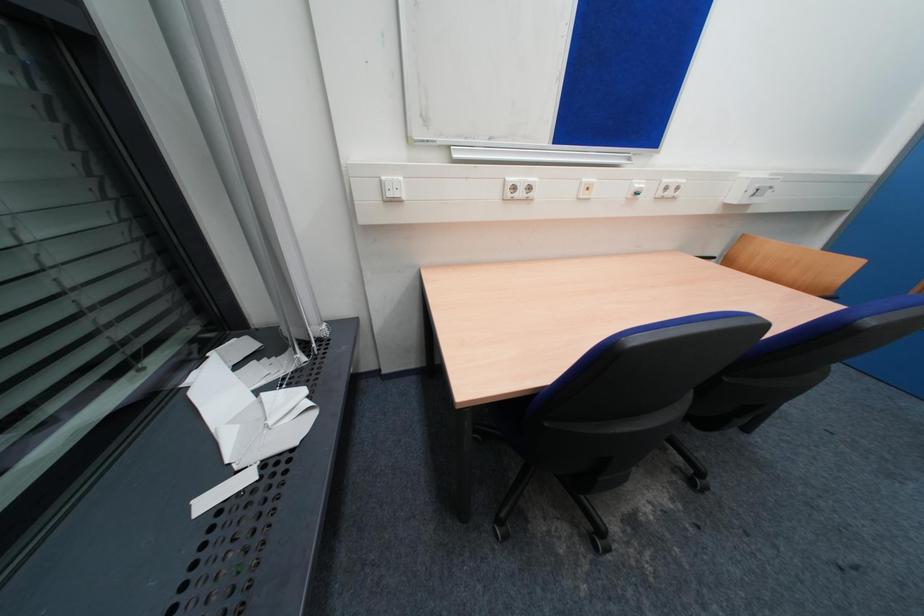
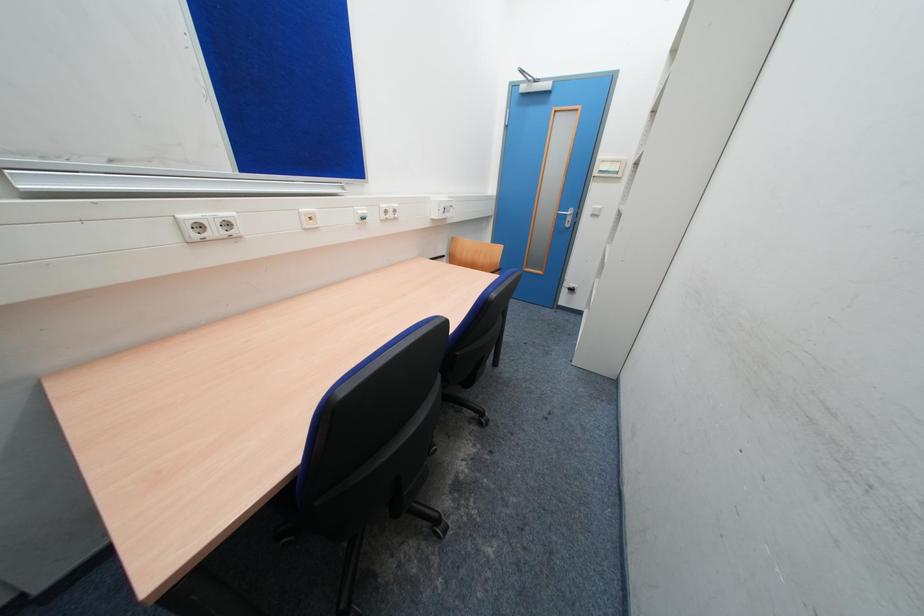
Question: The first image is from the beginning of the video and the second image is from the end. How did the camera likely rotate when shooting the video?

Choices:
 (A) Left
 (B) Right
 (C) Up
 (D) Down

Answer: (B)